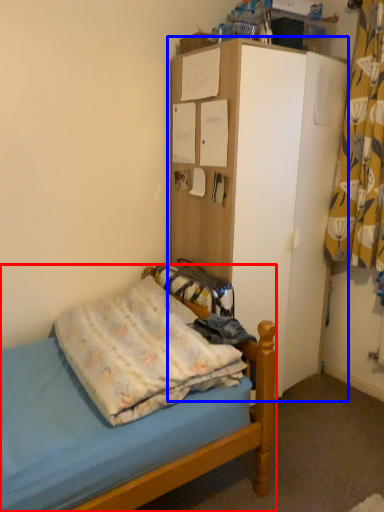
Question: Which point is further to the camera, bed (highlighted by a red box) or dresser (highlighted by a blue box)?

Choices:
 (A) bed
 (B) dresser

Answer: (B)